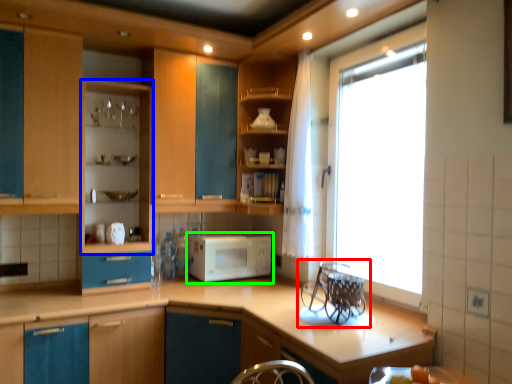
Question: Based on their relative distances, which object is farther from appliance (highlighted by a red box)? Choose from cabinetry (highlighted by a blue box) and microwave oven (highlighted by a green box).

Choices:
 (A) cabinetry
 (B) microwave oven

Answer: (A)